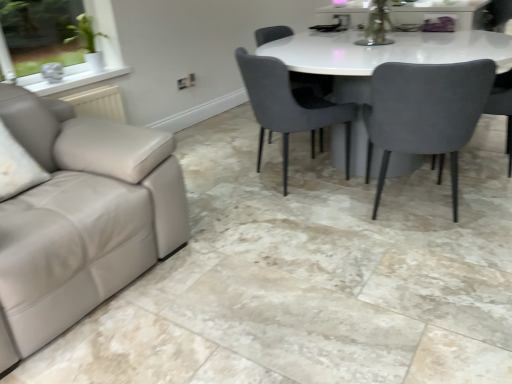
This screenshot has width=512, height=384. What are the coordinates of `vacant space positioned to the left of suede gray chair at right, arranged as the third chair when viewed from the left` in the screenshot? It's located at (314, 227).